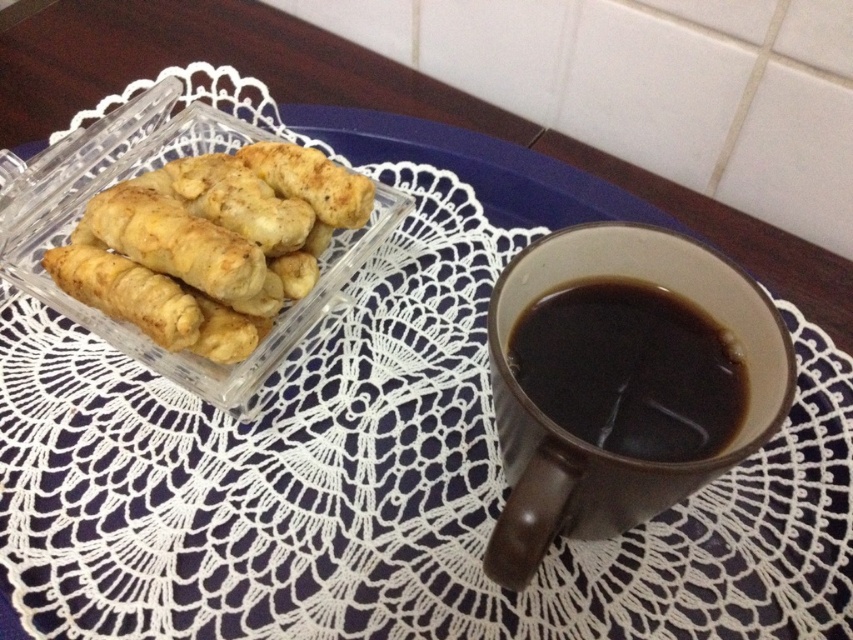
Question: Is brown ceramic mug at right further to camera compared to golden crispy pastry at left?

Choices:
 (A) no
 (B) yes

Answer: (A)

Question: Can you confirm if brown ceramic mug at right is thinner than golden crispy pastry at left?

Choices:
 (A) yes
 (B) no

Answer: (A)

Question: Estimate the real-world distances between objects in this image. Which object is farther from the golden crispy pastry at left?

Choices:
 (A) black matte mug at right
 (B) brown ceramic mug at right

Answer: (A)

Question: Is brown ceramic mug at right smaller than golden crispy pastry at left?

Choices:
 (A) no
 (B) yes

Answer: (A)

Question: Among these points, which one is nearest to the camera?

Choices:
 (A) (550, 356)
 (B) (224, 209)
 (C) (722, 276)

Answer: (C)

Question: Which point is closer to the camera?

Choices:
 (A) brown ceramic mug at right
 (B) golden crispy pastry at left

Answer: (A)